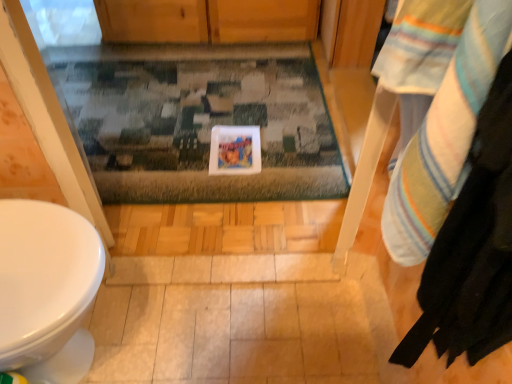
Question: From the image's perspective, does striped cotton towel at right appear higher than multicolored textured rug at center?

Choices:
 (A) yes
 (B) no

Answer: (B)

Question: Does striped cotton towel at right come behind multicolored textured rug at center?

Choices:
 (A) yes
 (B) no

Answer: (B)

Question: Is striped cotton towel at right wider than multicolored textured rug at center?

Choices:
 (A) yes
 (B) no

Answer: (B)

Question: Does striped cotton towel at right touch multicolored textured rug at center?

Choices:
 (A) yes
 (B) no

Answer: (B)

Question: From the image's perspective, is striped cotton towel at right located beneath multicolored textured rug at center?

Choices:
 (A) yes
 (B) no

Answer: (A)

Question: Is striped cotton towel at right not inside multicolored textured rug at center?

Choices:
 (A) no
 (B) yes

Answer: (B)

Question: Is multicolored textured rug at center thinner than striped cotton towel at right?

Choices:
 (A) no
 (B) yes

Answer: (A)

Question: Is multicolored textured rug at center at the left side of striped cotton towel at right?

Choices:
 (A) yes
 (B) no

Answer: (A)

Question: Is multicolored textured rug at center beside striped cotton towel at right?

Choices:
 (A) yes
 (B) no

Answer: (B)

Question: Is multicolored textured rug at center wider than striped cotton towel at right?

Choices:
 (A) yes
 (B) no

Answer: (A)

Question: Is multicolored textured rug at center oriented away from striped cotton towel at right?

Choices:
 (A) yes
 (B) no

Answer: (B)

Question: Is multicolored textured rug at center outside of striped cotton towel at right?

Choices:
 (A) no
 (B) yes

Answer: (B)

Question: Considering the relative positions of multicolored textured rug at center and striped cotton towel at right in the image provided, is multicolored textured rug at center to the left or to the right of striped cotton towel at right?

Choices:
 (A) right
 (B) left

Answer: (B)